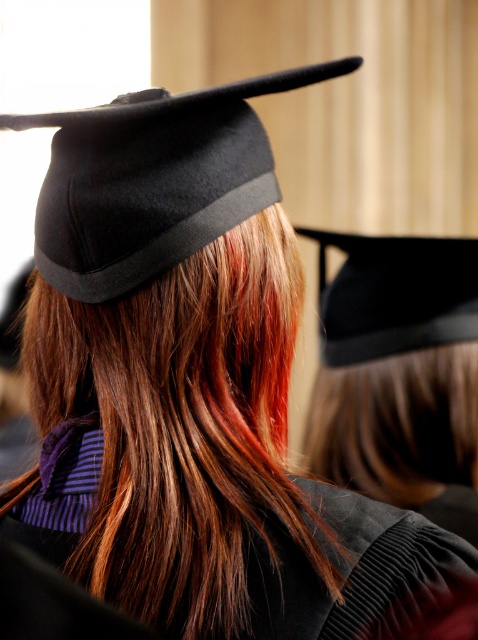
You are a photographer at a graduation ceremony. You need to capture a closeup shot of the brown silky hair at center and the black felt graduation cap at upper center. Can you fit both subjects into a frame that can only accommodate objects with a combined width of 15 inches?

The brown silky hair at center has a width less than the black felt graduation cap at upper center. Since the combined width of both subjects must be under 15 inches, and the hair is narrower than the cap, their total width would be less than double the cap alone. If the cap alone is under 15 inches, then yes, but without exact measurements, we can assume they fit together within the limit.

In the scene shown: You are attending a graduation ceremony and notice two items on stage. The black felt graduation cap at upper center and the velvet black robe at center. Which item is positioned to the left when viewed from the front of the stage?

The black felt graduation cap at upper center is positioned to the left of the velvet black robe at center when viewed from the front of the stage.

You are a photographer at a graduation ceremony. You need to adjust the lighting so that both the brown silky hair at center and the black felt graduation cap at upper center are well lit. Which object should you focus on first to ensure proper exposure?

The brown silky hair at center is taller than the black felt graduation cap at upper center, so you should focus on the brown silky hair at center first to ensure proper exposure.